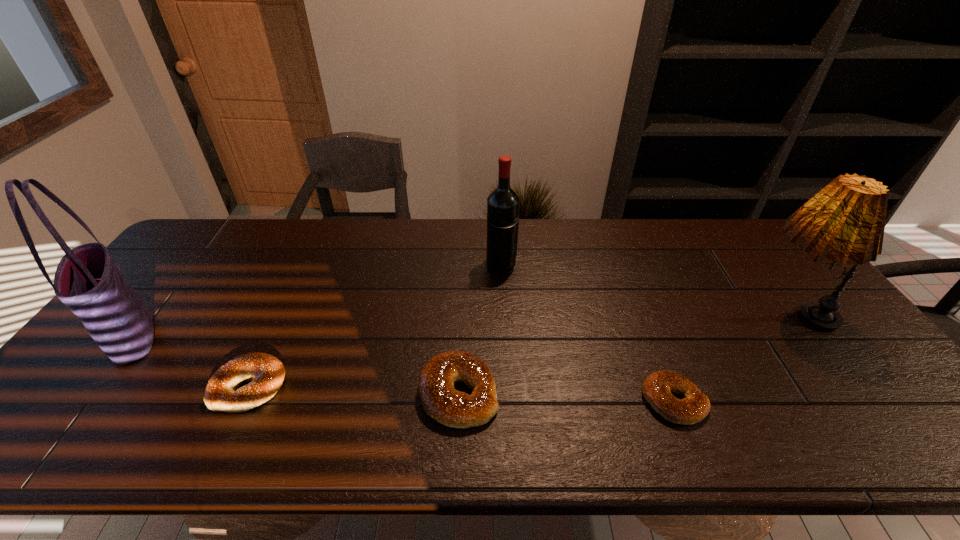
Where is `the second shortest object`? The height and width of the screenshot is (540, 960). the second shortest object is located at coordinates (266, 372).

Locate an element on the screen. Image resolution: width=960 pixels, height=540 pixels. the second tallest bagel is located at coordinates [x=266, y=372].

This screenshot has width=960, height=540. I want to click on the second bagel from right to left, so click(x=441, y=401).

Find the location of a particular element. the rightmost bagel is located at coordinates (657, 387).

The width and height of the screenshot is (960, 540). Identify the location of the second object from right to left. (657, 387).

Locate an element on the screen. The image size is (960, 540). the farthest object is located at coordinates (503, 202).

Locate an element on the screen. lampshade is located at coordinates (844, 222).

This screenshot has height=540, width=960. I want to click on tote bag, so click(87, 280).

Find the location of a particular element. The image size is (960, 540). free region located on the right of the leftmost bagel is located at coordinates (401, 386).

At what (x,y) coordinates should I click in order to perform the action: click on free space located on the right of the second bagel from left to right. Please return your answer as a coordinate pair (x, y). The height and width of the screenshot is (540, 960). Looking at the image, I should click on (595, 393).